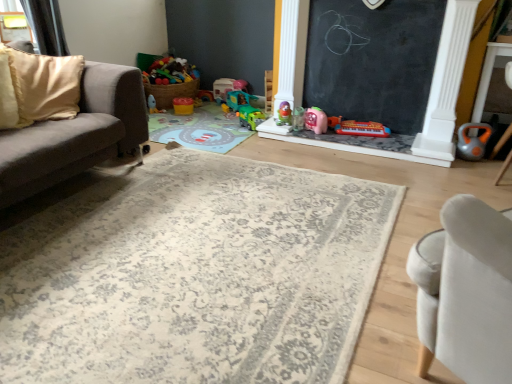
Find the location of a particular element. free space between green plastic toy car at center, which is the 6th toy from right to left, and matte plastic toy at upper center, the 10th toy positioned from the right is located at coordinates pyautogui.click(x=207, y=118).